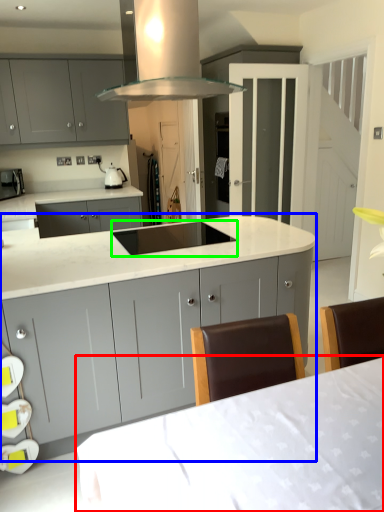
Question: Which object is positioned closest to table (highlighted by a red box)? Select from cabinetry (highlighted by a blue box) and sink (highlighted by a green box).

Choices:
 (A) cabinetry
 (B) sink

Answer: (A)